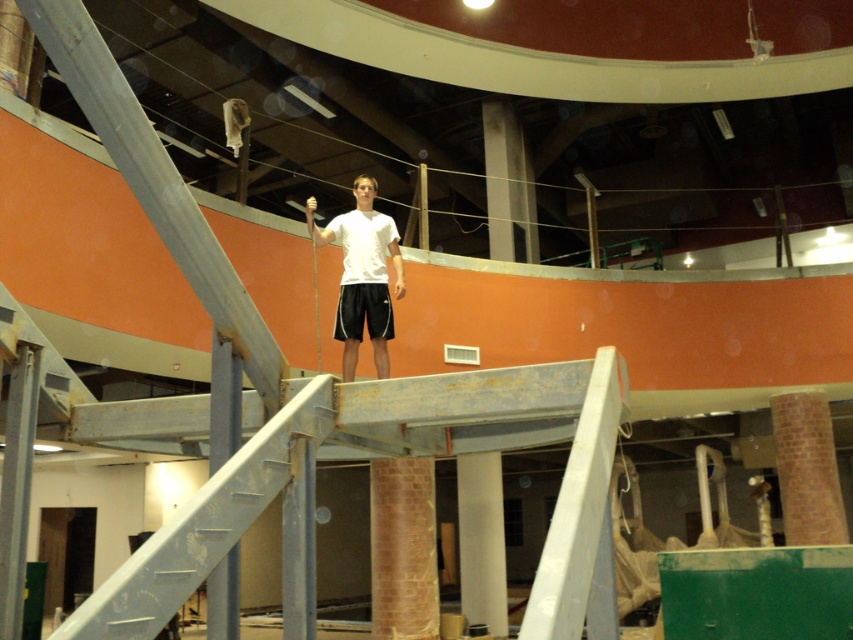
Does white matte shirt at center have a lesser height compared to white glossy column at center?

Yes, white matte shirt at center is shorter than white glossy column at center.

Can you confirm if white matte shirt at center is wider than white glossy column at center?

Correct, the width of white matte shirt at center exceeds that of white glossy column at center.

Does point (398, 237) come farther from viewer compared to point (482, 605)?

No, it is not.

This screenshot has height=640, width=853. In order to click on white matte shirt at center in this screenshot , I will do `click(363, 275)`.

Can you confirm if brick textured pillar at center is wider than white glossy column at center?

Yes.

Who is more forward, [370,595] or [462,548]?

Point [462,548] is in front.

Which is behind, point (407, 525) or point (477, 477)?

Point (477, 477)

At what (x,y) coordinates should I click in order to perform the action: click on brick textured pillar at center. Please return your answer as a coordinate pair (x, y). Looking at the image, I should click on (403, 548).

Does white matte shirt at center have a lesser height compared to black cotton shorts at center?

No, white matte shirt at center is not shorter than black cotton shorts at center.

Looking at this image, can you confirm if white matte shirt at center is smaller than black cotton shorts at center?

Actually, white matte shirt at center might be larger than black cotton shorts at center.

Find the location of a particular element. This screenshot has height=640, width=853. white matte shirt at center is located at coordinates click(x=363, y=275).